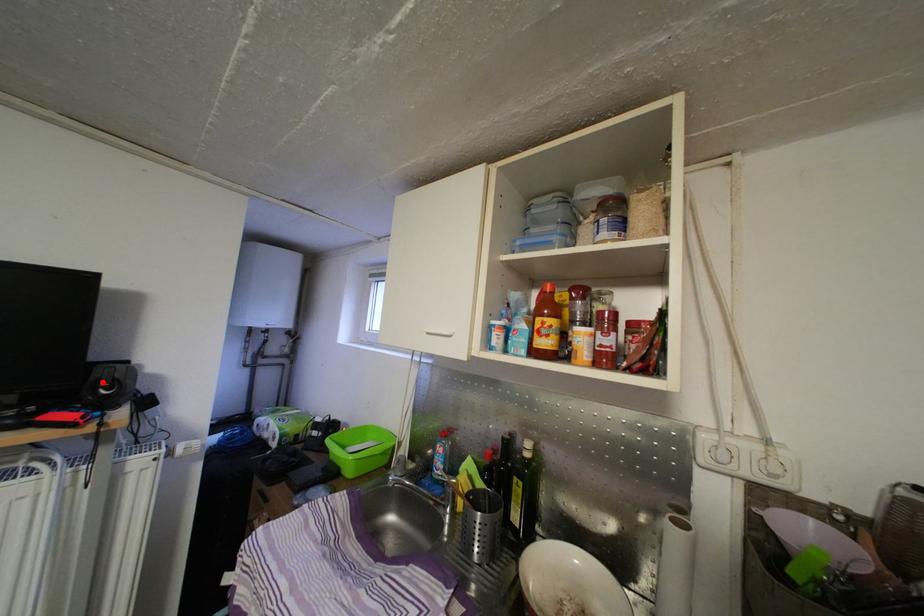
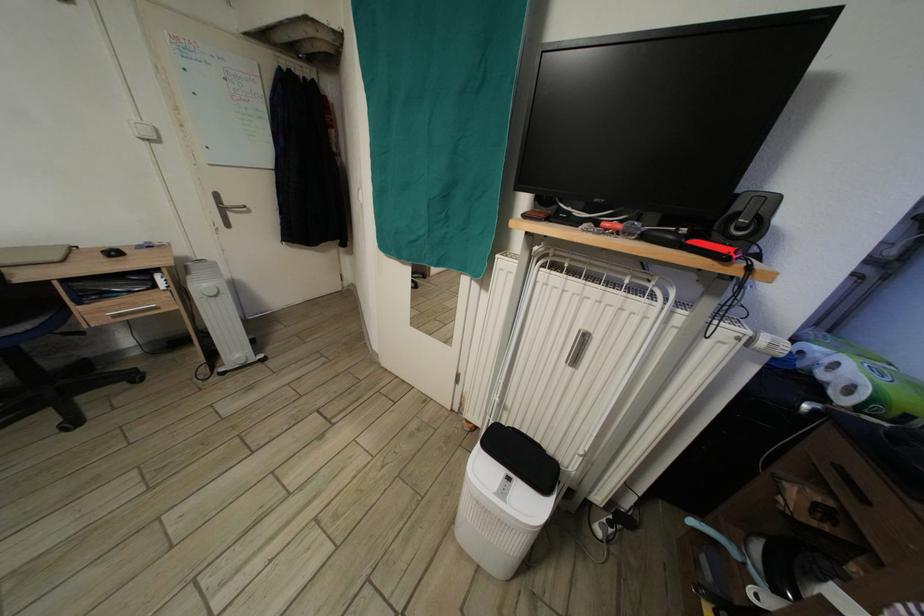
Where in the second image is the point corresponding to the highlighted location from the first image?

(744, 214)